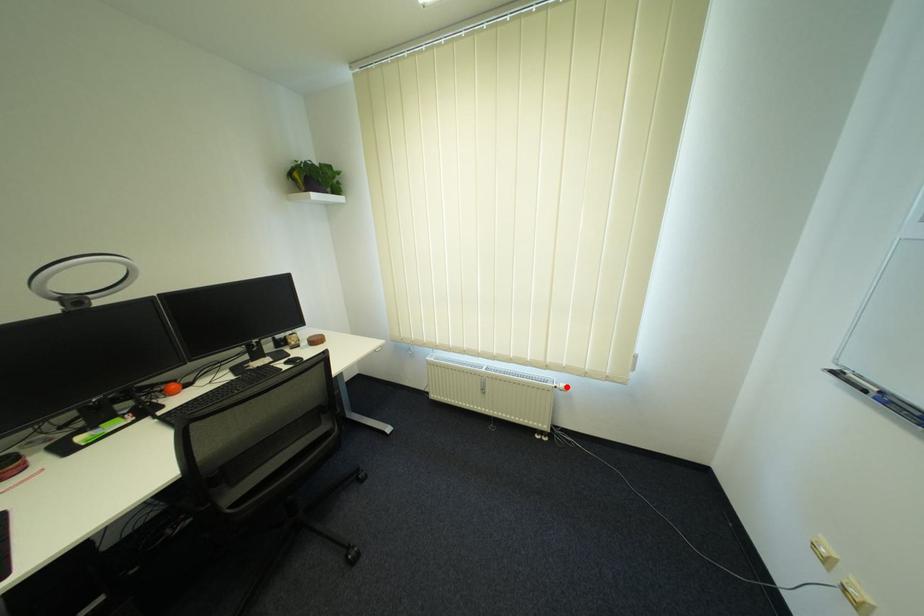
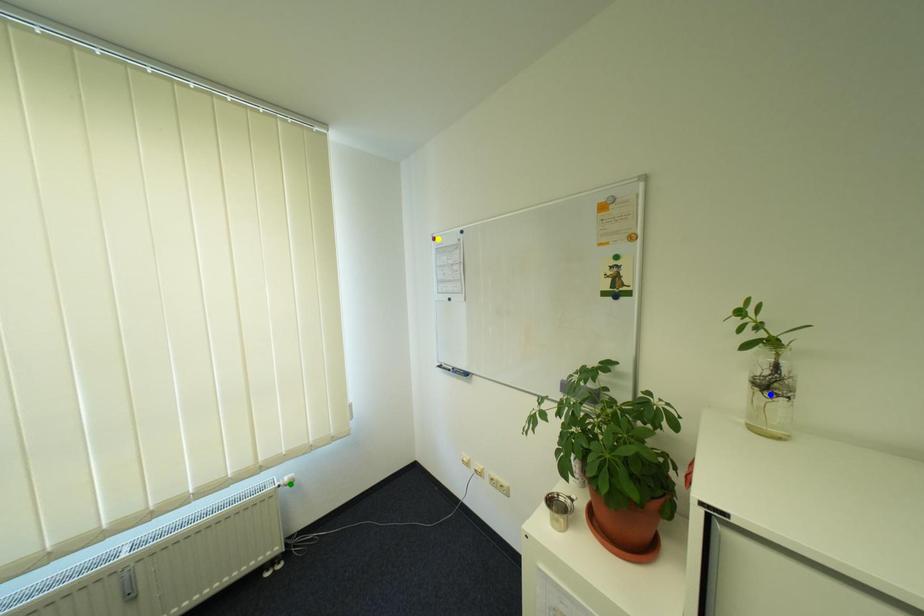
Question: I am providing you with two images of the same scene from different viewpoints. A red point is marked on the first image. You are given multiple points on the second image. Which point in image 2 represents the same 3d spot as the red point in image 1?

Choices:
 (A) yellow point
 (B) blue point
 (C) green point

Answer: (C)